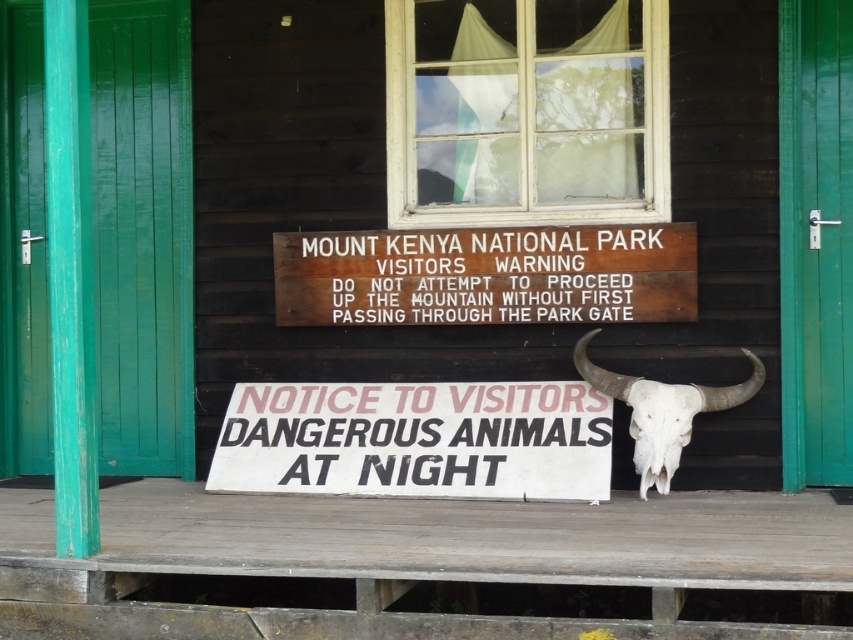
You are a hiker planning to enter Mount Kenya National Park. You see the brown wooden sign at upper center. Where exactly is the sign positioned relative to the entrance structure?

The brown wooden sign at upper center is located at point coordinates of (486, 275) relative to the entrance structure.

You are a park ranger who needs to place a new 12 inch wide information board between the white paper sign at lower center and the brown wooden sign at upper center. Is there enough space for it?

The white paper sign at lower center and brown wooden sign at upper center are 20.07 inches apart from each other. Since the information board is 12 inches wide, there is enough space between them to place it.

You are a photographer standing at the entrance of Mount Kenya National Park. You want to take a photo of the white paper sign at lower center while keeping your camera at a safe distance. What is the minimum distance you need to maintain between yourself and the sign to ensure the camera can capture the entire sign without moving closer?

The minimum distance you need to maintain between yourself and the white paper sign at lower center is 7.01 meters, as this is the distance specified between the sign and the camera to capture it fully without moving closer.